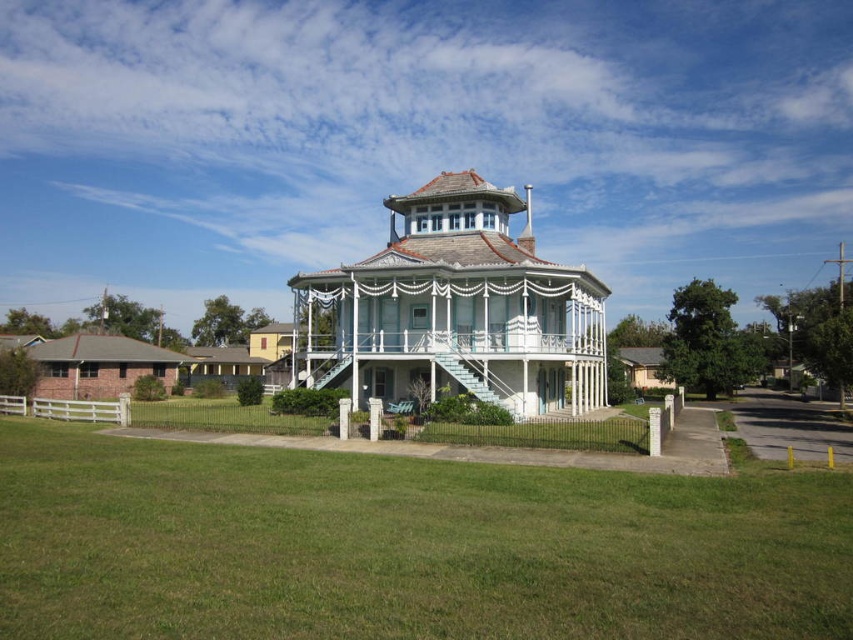
Does point (834, 579) lie in front of point (258, 336)?

Yes.

What do you see at coordinates (403, 547) in the screenshot?
I see `green grass at center` at bounding box center [403, 547].

Is point (223, 465) less distant than point (282, 384)?

That is True.

Identify the location of green grass at center. (403, 547).

Who is more forward, (431, 257) or (267, 330)?

Positioned in front is point (431, 257).

Consider the image. Between white painted wood gazebo at center and white painted wood porch at center, which one appears on the right side from the viewer's perspective?

white painted wood gazebo at center

Who is more forward, (454, 312) or (274, 352)?

Positioned in front is point (454, 312).

Find the location of a particular element. white painted wood gazebo at center is located at coordinates (456, 308).

Which is more to the right, green grass at center or white painted wood gazebo at center?

green grass at center

Can you confirm if green grass at center is positioned to the right of white painted wood gazebo at center?

Correct, you'll find green grass at center to the right of white painted wood gazebo at center.

This screenshot has height=640, width=853. Identify the location of green grass at center. (403, 547).

This screenshot has width=853, height=640. I want to click on green grass at center, so click(x=403, y=547).